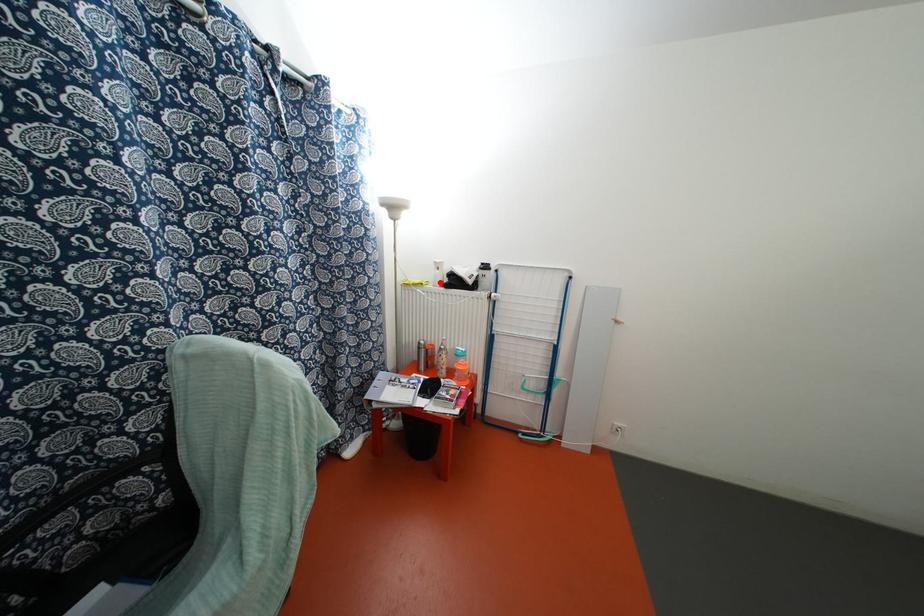
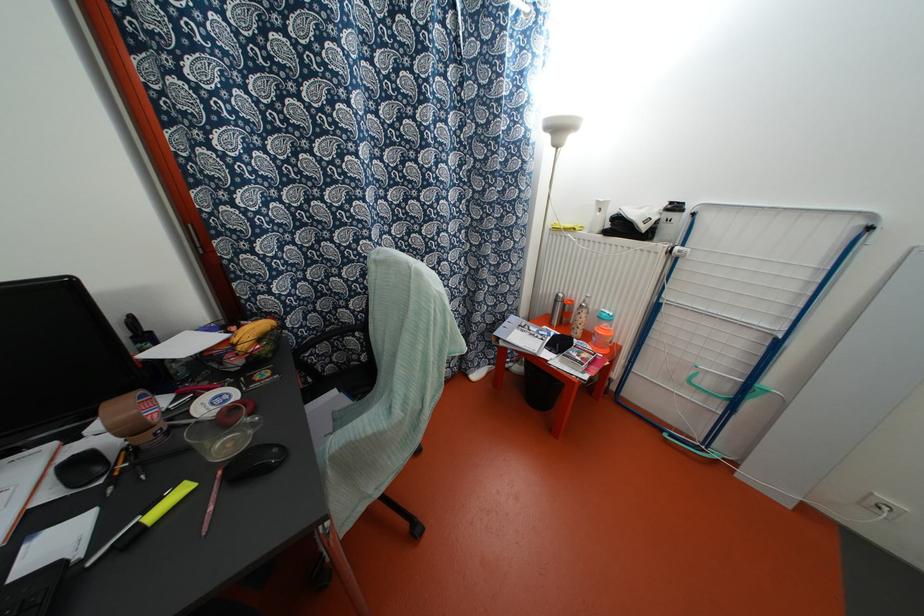
Find the pixel in the second image that matches the highlighted location in the first image.

(599, 228)